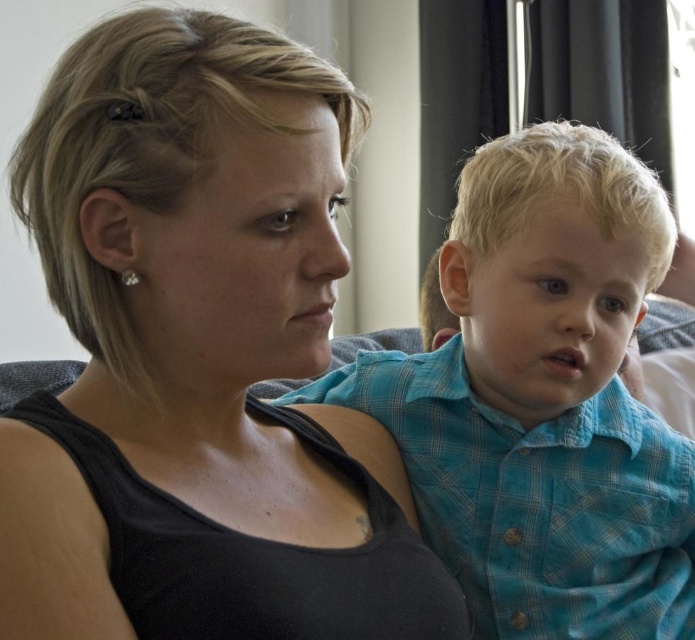
Question: Does black matte tank top at center appear over blue plaid shirt at center?

Choices:
 (A) yes
 (B) no

Answer: (B)

Question: Where is black matte tank top at center located in relation to blue plaid shirt at center in the image?

Choices:
 (A) below
 (B) above

Answer: (A)

Question: Is black matte tank top at center smaller than blue plaid shirt at center?

Choices:
 (A) yes
 (B) no

Answer: (B)